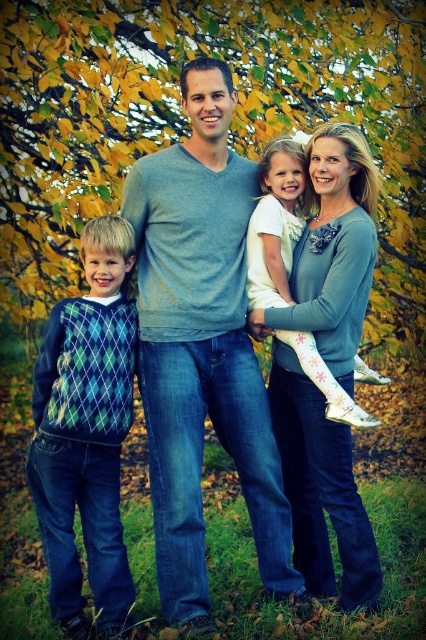
Which is behind, point (85, 547) or point (290, 195)?

Positioned behind is point (85, 547).

Can you confirm if argyle sweater at left is bigger than white soft fabric dress at center?

Yes.

Does point (89, 384) lie in front of point (362, 362)?

Yes, point (89, 384) is in front of point (362, 362).

Find the location of a particular element. The image size is (426, 640). argyle sweater at left is located at coordinates (86, 432).

Does yellow-green leaves at upper center appear on the left side of argyle sweater at left?

In fact, yellow-green leaves at upper center is to the right of argyle sweater at left.

Based on the photo, which is more to the left, yellow-green leaves at upper center or argyle sweater at left?

argyle sweater at left

At what (x,y) coordinates should I click in order to perform the action: click on yellow-green leaves at upper center. Please return your answer as a coordinate pair (x, y). Looking at the image, I should click on (187, 122).

Between yellow-green leaves at upper center and white soft fabric dress at center, which one is positioned higher?

Positioned higher is yellow-green leaves at upper center.

Is point (253, 88) positioned before point (275, 241)?

That is False.

Is point (2, 184) farther from camera compared to point (267, 192)?

That is True.

The image size is (426, 640). What are the coordinates of `yellow-green leaves at upper center` in the screenshot? It's located at (187, 122).